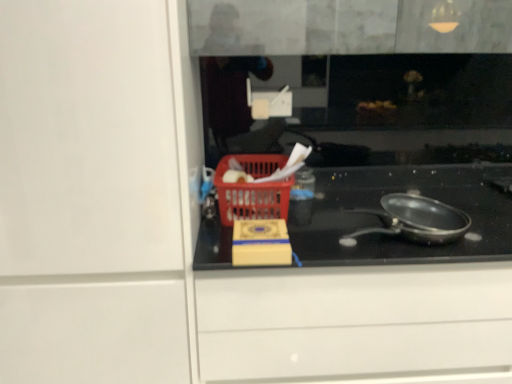
Question: In terms of width, does red plastic basket at center look wider or thinner when compared to shiny black frying pan at center?

Choices:
 (A) wide
 (B) thin

Answer: (A)

Question: From their relative heights in the image, would you say red plastic basket at center is taller or shorter than shiny black frying pan at center?

Choices:
 (A) short
 (B) tall

Answer: (B)

Question: Which is nearer to the shiny black frying pan at center?

Choices:
 (A) black glass cooktop at center
 (B) red plastic basket at center

Answer: (A)

Question: Which is farther from the red plastic basket at center?

Choices:
 (A) black glass cooktop at center
 (B) shiny black frying pan at center

Answer: (B)